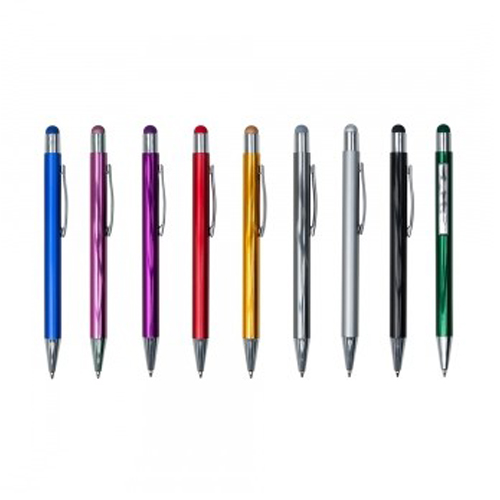
Find the location of a particular element. The width and height of the screenshot is (500, 500). pens is located at coordinates (53, 220), (98, 219), (149, 216), (199, 216), (252, 218), (303, 224), (352, 229), (397, 224), (448, 226).